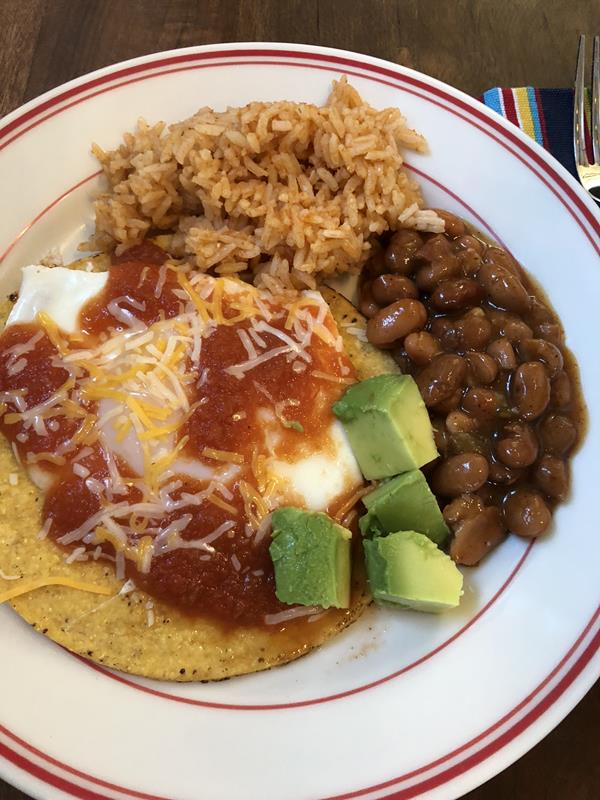
Identify the location of table. The image size is (600, 800). (555, 766), (284, 16), (2, 792).